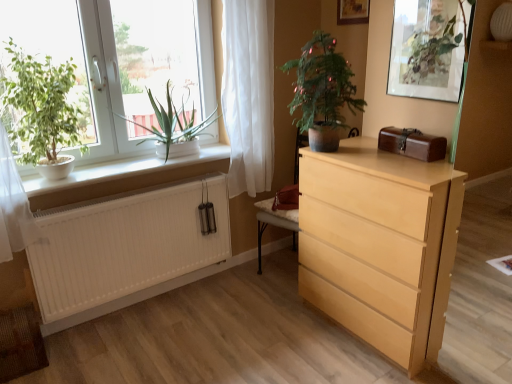
Where is `light wood chest of drawers at right`? The width and height of the screenshot is (512, 384). light wood chest of drawers at right is located at coordinates (380, 245).

What do you see at coordinates (248, 93) in the screenshot?
I see `white sheer curtain at upper center` at bounding box center [248, 93].

Identify the location of green leafy plant at left, the 2th houseplant from the right. This screenshot has height=384, width=512. (172, 124).

What do you see at coordinates (352, 12) in the screenshot? The image size is (512, 384). I see `wooden picture frame at upper center` at bounding box center [352, 12].

This screenshot has width=512, height=384. Describe the element at coordinates (125, 244) in the screenshot. I see `white matte radiator at lower left` at that location.

The image size is (512, 384). Describe the element at coordinates (41, 108) in the screenshot. I see `green matte plant at left, the first houseplant viewed from the left` at that location.

What is the approximate width of white matte window sill at left?

It is 12.16 inches.

Where is `light wood chest of drawers at right`? light wood chest of drawers at right is located at coordinates (x=380, y=245).

How distant is white matte window sill at left from white sheer curtain at upper center?

They are 20.37 inches apart.

Is white matte window sill at left with white sheer curtain at upper center?

No.

Which object is more forward, white matte window sill at left or white sheer curtain at upper center?

white matte window sill at left is closer to the camera.

From the image's perspective, would you say white matte window sill at left is positioned over white sheer curtain at upper center?

Actually, white matte window sill at left appears below white sheer curtain at upper center in the image.

Is green leafy plant at left, the 2th houseplant from the right, oriented towards light wood chest of drawers at right?

No, green leafy plant at left, the 2th houseplant from the right, is not oriented towards light wood chest of drawers at right.

Does green leafy plant at left, the 2th houseplant from the right, touch light wood chest of drawers at right?

No, green leafy plant at left, the 2th houseplant from the right, is not touching light wood chest of drawers at right.

From a real-world perspective, who is located higher, green leafy plant at left, the 2th houseplant from the right, or light wood chest of drawers at right?

green leafy plant at left, the 2th houseplant from the right, is physically above.

Does green leafy plant at left, which is the second houseplant in left-to-right order, have a lesser width compared to light wood chest of drawers at right?

Yes, green leafy plant at left, which is the second houseplant in left-to-right order, is thinner than light wood chest of drawers at right.

In terms of height, does white plastic window at left look taller or shorter compared to green matte plant at upper right?

white plastic window at left is taller than green matte plant at upper right.

Which point is more forward, (204, 11) or (440, 62)?

Positioned in front is point (440, 62).

The width and height of the screenshot is (512, 384). What are the coordinates of `vegetation positioned vertically above the white plastic window at left (from a real-world perspective)` in the screenshot? It's located at (432, 45).

Is there a large distance between white plastic window at left and green matte plant at upper right?

white plastic window at left is positioned a significant distance from green matte plant at upper right.

Can you confirm if brown leather box at upper right is shorter than white sheer curtain at upper center?

Indeed, brown leather box at upper right has a lesser height compared to white sheer curtain at upper center.

Based on the photo, from the image's perspective, between brown leather box at upper right and white sheer curtain at upper center, which one is located above?

white sheer curtain at upper center is shown above in the image.

Considering the sizes of objects brown leather box at upper right and white sheer curtain at upper center in the image provided, who is wider, brown leather box at upper right or white sheer curtain at upper center?

brown leather box at upper right.

How many degrees apart are the facing directions of white matte window sill at left and green matte plant at upper right?

89.3 degrees.

Considering the sizes of objects white matte window sill at left and green matte plant at upper right in the image provided, who is taller, white matte window sill at left or green matte plant at upper right?

green matte plant at upper right.

Is white matte window sill at left not inside green matte plant at upper right?

Yes, white matte window sill at left is located beyond the bounds of green matte plant at upper right.

Which of these two, white matte window sill at left or green matte plant at upper right, is thinner?

Thinner between the two is green matte plant at upper right.

Between wooden picture frame at upper center and green matte plant at center, the 1th houseplant in the right-to-left sequence, which one has smaller size?

wooden picture frame at upper center.

Which of these two, wooden picture frame at upper center or green matte plant at center, the 1th houseplant in the right-to-left sequence, is thinner?

With smaller width is wooden picture frame at upper center.

Considering the positions of objects wooden picture frame at upper center and green matte plant at center, the 1th houseplant in the right-to-left sequence, in the image provided, who is more to the left, wooden picture frame at upper center or green matte plant at center, the 1th houseplant in the right-to-left sequence,?

green matte plant at center, the 1th houseplant in the right-to-left sequence.

From a real-world perspective, is wooden picture frame at upper center physically located above or below green matte plant at center, the 3th houseplant when ordered from left to right?

From a real-world perspective, wooden picture frame at upper center is physically above green matte plant at center, the 3th houseplant when ordered from left to right.

Does point (451, 9) come farther from viewer compared to point (401, 240)?

Yes, it is.

From a real-world perspective, is green matte plant at upper right physically above light wood chest of drawers at right?

Correct, in the physical world, green matte plant at upper right is higher than light wood chest of drawers at right.

Considering the relative sizes of green matte plant at upper right and light wood chest of drawers at right in the image provided, is green matte plant at upper right taller than light wood chest of drawers at right?

Incorrect, the height of green matte plant at upper right is not larger of that of light wood chest of drawers at right.

Is green matte plant at upper right completely or partially outside of light wood chest of drawers at right?

Yes, green matte plant at upper right is located beyond the bounds of light wood chest of drawers at right.

Where is `curtain that appears above the white matte window sill at left (from the image's perspective)`? The width and height of the screenshot is (512, 384). curtain that appears above the white matte window sill at left (from the image's perspective) is located at coordinates (248, 93).

At what (x,y) coordinates should I click in order to perform the action: click on the 1st houseplant above the light wood chest of drawers at right (from a real-world perspective). Please return your answer as a coordinate pair (x, y). This screenshot has height=384, width=512. Looking at the image, I should click on (172, 124).

Looking at the image, which one is located further to wooden picture frame at upper center, green leafy plant at left, the 2th houseplant from the right, or green matte plant at upper right?

green leafy plant at left, the 2th houseplant from the right.

Considering their positions, is wooden picture frame at upper center positioned closer to green matte plant at upper right than white plastic window at left?

Among the two, wooden picture frame at upper center is located nearer to green matte plant at upper right.

Estimate the real-world distances between objects in this image. Which object is further from green matte plant at upper right, green leafy plant at left, which is the second houseplant in left-to-right order, or brown leather box at upper right?

Based on the image, green leafy plant at left, which is the second houseplant in left-to-right order, appears to be further to green matte plant at upper right.

Looking at the image, which one is located further to white matte window sill at left, white sheer curtain at upper center or green matte plant at upper right?

Among the two, green matte plant at upper right is located further to white matte window sill at left.

Considering their positions, is brown leather box at upper right positioned further to white matte radiator at lower left than white sheer curtain at upper center?

Among the two, brown leather box at upper right is located further to white matte radiator at lower left.

Considering their positions, is white plastic window at left positioned further to white sheer curtain at upper center than brown leather box at upper right?

brown leather box at upper right lies further to white sheer curtain at upper center than the other object.

Looking at this image, from the image, which object appears to be nearer to white matte radiator at lower left, green leafy plant at left, the 2th houseplant from the right, or white sheer curtain at upper center?

green leafy plant at left, the 2th houseplant from the right, is closer to white matte radiator at lower left.

From the image, which object appears to be nearer to brown leather box at upper right, white matte radiator at lower left or green matte plant at center, the 3th houseplant when ordered from left to right?

The object closer to brown leather box at upper right is green matte plant at center, the 3th houseplant when ordered from left to right.

Locate an element on the screen. Image resolution: width=512 pixels, height=384 pixels. curtain located between white plastic window at left and brown leather box at upper right in the left-right direction is located at coordinates (248, 93).

Locate an element on the screen. This screenshot has height=384, width=512. window situated between green matte plant at left, the first houseplant viewed from the left, and light wood chest of drawers at right from left to right is located at coordinates (104, 87).

The height and width of the screenshot is (384, 512). In order to click on curtain between green matte plant at left, which is counted as the third houseplant, starting from the right, and light wood chest of drawers at right in this screenshot , I will do `click(248, 93)`.

At what (x,y) coordinates should I click in order to perform the action: click on picture frame located between white matte window sill at left and brown leather box at upper right in the left-right direction. Please return your answer as a coordinate pair (x, y). Looking at the image, I should click on (352, 12).